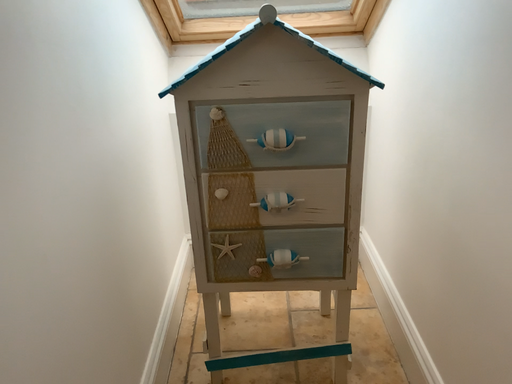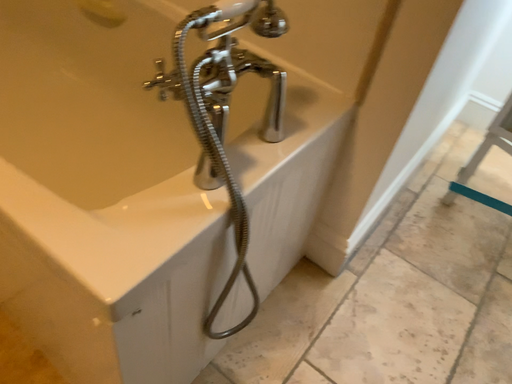
Question: Which way did the camera rotate in the video?

Choices:
 (A) rotated right
 (B) rotated left

Answer: (B)